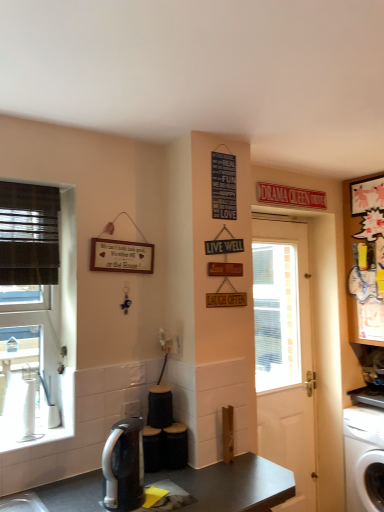
The height and width of the screenshot is (512, 384). Find the location of `vacant area on top of white matte door at center (from a real-world perspective)`. vacant area on top of white matte door at center (from a real-world perspective) is located at coordinates (292, 218).